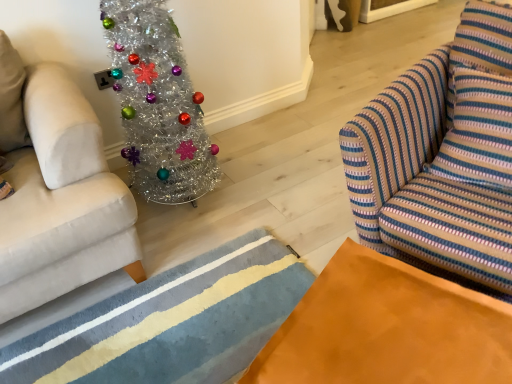
Question: Is orange suede table at lower right aimed at textured wool rug at lower center?

Choices:
 (A) yes
 (B) no

Answer: (B)

Question: From the image's perspective, is orange suede table at lower right on top of textured wool rug at lower center?

Choices:
 (A) yes
 (B) no

Answer: (B)

Question: Considering the relative sizes of orange suede table at lower right and textured wool rug at lower center in the image provided, is orange suede table at lower right smaller than textured wool rug at lower center?

Choices:
 (A) yes
 (B) no

Answer: (B)

Question: Is the depth of orange suede table at lower right less than that of textured wool rug at lower center?

Choices:
 (A) yes
 (B) no

Answer: (A)

Question: Does orange suede table at lower right have a greater height compared to textured wool rug at lower center?

Choices:
 (A) no
 (B) yes

Answer: (B)

Question: Is orange suede table at lower right outside of textured wool rug at lower center?

Choices:
 (A) yes
 (B) no

Answer: (A)

Question: From the image's perspective, would you say orange suede table at lower right is positioned over striped fabric swivel chair at right?

Choices:
 (A) no
 (B) yes

Answer: (A)

Question: Does orange suede table at lower right have a greater height compared to striped fabric swivel chair at right?

Choices:
 (A) no
 (B) yes

Answer: (A)

Question: Is orange suede table at lower right wider than striped fabric swivel chair at right?

Choices:
 (A) no
 (B) yes

Answer: (A)

Question: Is orange suede table at lower right to the left of striped fabric swivel chair at right from the viewer's perspective?

Choices:
 (A) yes
 (B) no

Answer: (A)

Question: From a real-world perspective, is orange suede table at lower right positioned under striped fabric swivel chair at right based on gravity?

Choices:
 (A) yes
 (B) no

Answer: (A)

Question: Is orange suede table at lower right looking in the opposite direction of striped fabric swivel chair at right?

Choices:
 (A) no
 (B) yes

Answer: (B)

Question: Can you confirm if shiny silver christmas tree at left is wider than orange suede table at lower right?

Choices:
 (A) yes
 (B) no

Answer: (B)